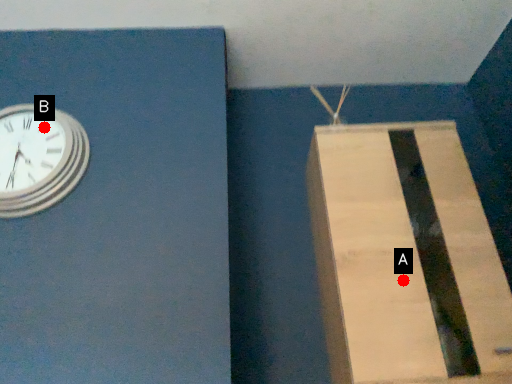
Question: Two points are circled on the image, labeled by A and B beside each circle. Which of the following is the farthest from the observer?

Choices:
 (A) A is further
 (B) B is further

Answer: (B)